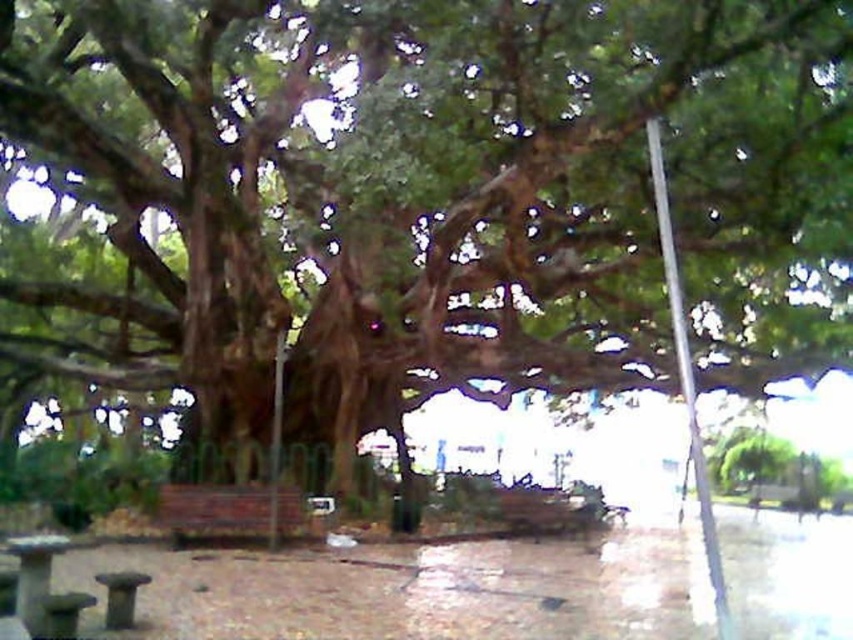
Question: Considering the relative positions of wooden picnic table at lower left and wooden park bench at lower left in the image provided, where is wooden picnic table at lower left located with respect to wooden park bench at lower left?

Choices:
 (A) left
 (B) right

Answer: (A)

Question: Which point is closer to the camera?

Choices:
 (A) (164, 518)
 (B) (112, 612)

Answer: (B)

Question: Is wooden picnic table at lower left bigger than wooden park bench at lower left?

Choices:
 (A) yes
 (B) no

Answer: (A)

Question: Which of these objects is positioned closest to the wooden park bench at lower left?

Choices:
 (A) brown wooden bench at lower center
 (B) wooden picnic table at lower left

Answer: (B)

Question: Which point appears closest to the camera in this image?

Choices:
 (A) (183, 496)
 (B) (27, 611)

Answer: (B)

Question: Is brown wooden bench at lower center thinner than wooden park bench at lower left?

Choices:
 (A) no
 (B) yes

Answer: (A)